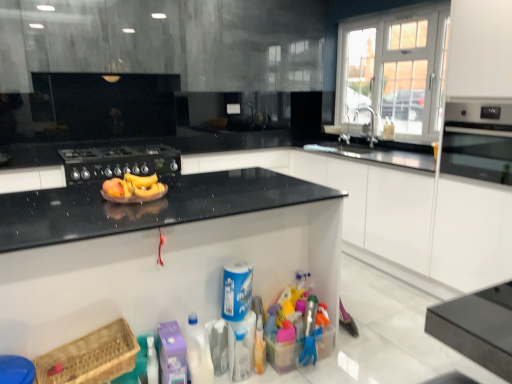
Question: Are yellow matte banana at center and matte black oven at right making contact?

Choices:
 (A) no
 (B) yes

Answer: (A)

Question: From a real-world perspective, is yellow matte banana at center under matte black oven at right?

Choices:
 (A) no
 (B) yes

Answer: (B)

Question: Is yellow matte banana at center looking in the opposite direction of matte black oven at right?

Choices:
 (A) yes
 (B) no

Answer: (B)

Question: Does yellow matte banana at center have a lesser width compared to matte black oven at right?

Choices:
 (A) yes
 (B) no

Answer: (A)

Question: Is yellow matte banana at center far away from matte black oven at right?

Choices:
 (A) no
 (B) yes

Answer: (B)

Question: In the image, is brown woven basket at lower left positioned in front of or behind silver metallic faucet at upper right?

Choices:
 (A) front
 (B) behind

Answer: (A)

Question: Based on their positions, is brown woven basket at lower left located to the left or right of silver metallic faucet at upper right?

Choices:
 (A) right
 (B) left

Answer: (B)

Question: Choose the correct answer: Is brown woven basket at lower left inside silver metallic faucet at upper right or outside it?

Choices:
 (A) inside
 (B) outside

Answer: (B)

Question: Is brown woven basket at lower left bigger or smaller than silver metallic faucet at upper right?

Choices:
 (A) small
 (B) big

Answer: (B)

Question: Is blue plastic canister at center, marked as the 2th cleaning product in a right-to-left arrangement, taller or shorter than white plastic bottle at lower center, which is the 2th cleaning product from left to right?

Choices:
 (A) short
 (B) tall

Answer: (A)

Question: From a real-world perspective, is blue plastic canister at center, the 3th cleaning product from the left, above or below white plastic bottle at lower center, which is the 2th cleaning product from left to right?

Choices:
 (A) above
 (B) below

Answer: (A)

Question: From the image's perspective, is blue plastic canister at center, marked as the 2th cleaning product in a right-to-left arrangement, located above or below white plastic bottle at lower center, which is the 2th cleaning product from left to right?

Choices:
 (A) above
 (B) below

Answer: (A)

Question: Considering the positions of blue plastic canister at center, marked as the 2th cleaning product in a right-to-left arrangement, and white plastic bottle at lower center, the 3th cleaning product positioned from the right, in the image, is blue plastic canister at center, marked as the 2th cleaning product in a right-to-left arrangement, bigger or smaller than white plastic bottle at lower center, the 3th cleaning product positioned from the right,?

Choices:
 (A) big
 (B) small

Answer: (B)

Question: From a real-world perspective, is blue plastic canister at center, the 3th cleaning product from the left, physically located above or below matte black oven at right?

Choices:
 (A) below
 (B) above

Answer: (A)

Question: From the image's perspective, is blue plastic canister at center, the 3th cleaning product from the left, above or below matte black oven at right?

Choices:
 (A) below
 (B) above

Answer: (A)